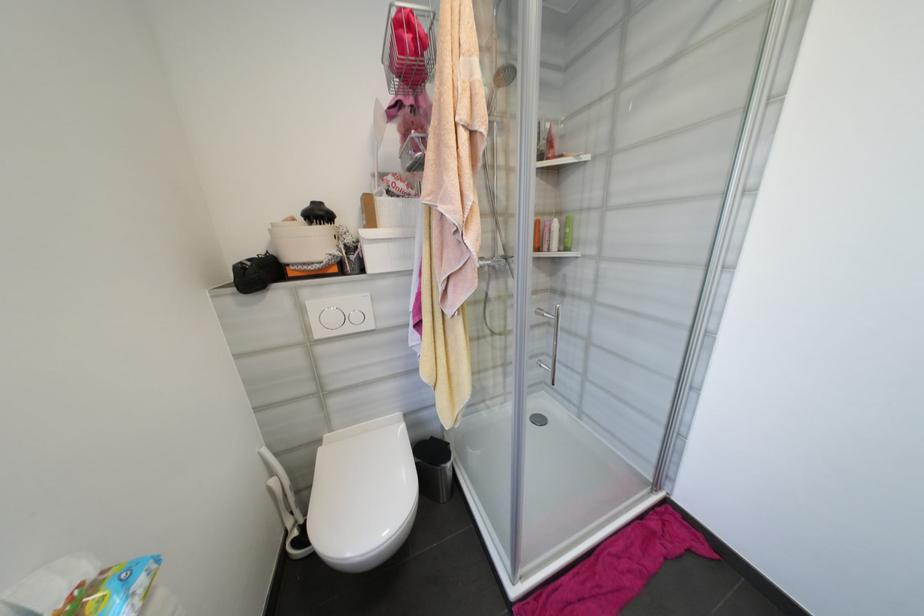
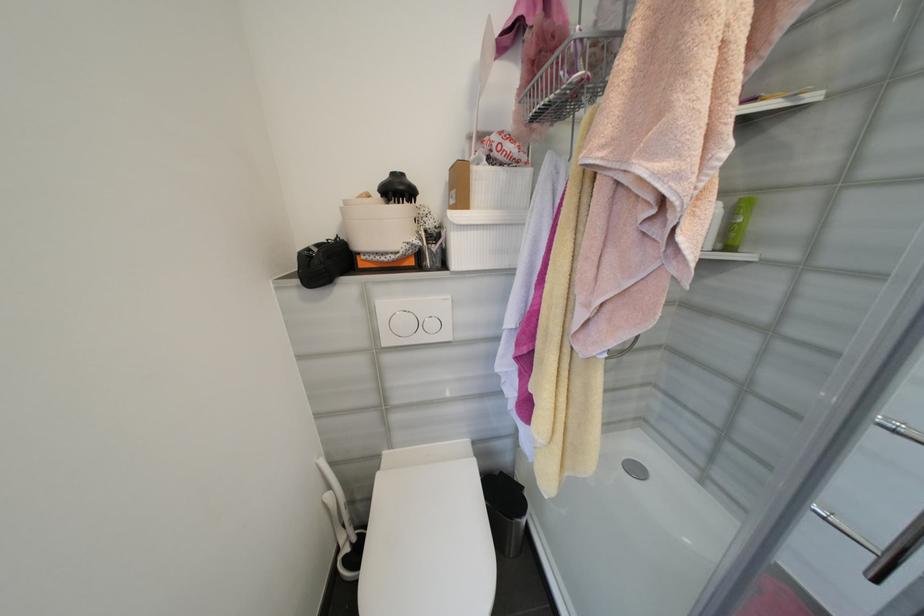
Question: How did the camera likely rotate?

Choices:
 (A) Left
 (B) Right
 (C) Up
 (D) Down

Answer: (A)